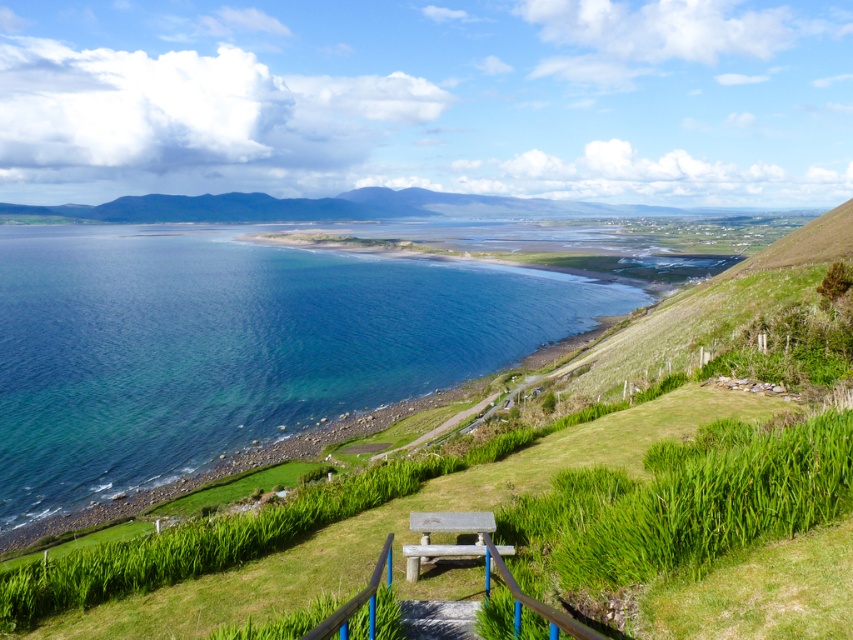
Who is positioned more to the left, clear blue water at lower left or wooden park bench at center?

clear blue water at lower left

Describe the element at coordinates (231, 346) in the screenshot. I see `clear blue water at lower left` at that location.

You are a GUI agent. You are given a task and a screenshot of the screen. Output one action in this format:
    pyautogui.click(x=<x>, y=<y>)
    Task: Click on the clear blue water at lower left
    This screenshot has width=853, height=640.
    Given the screenshot: What is the action you would take?
    pyautogui.click(x=231, y=346)